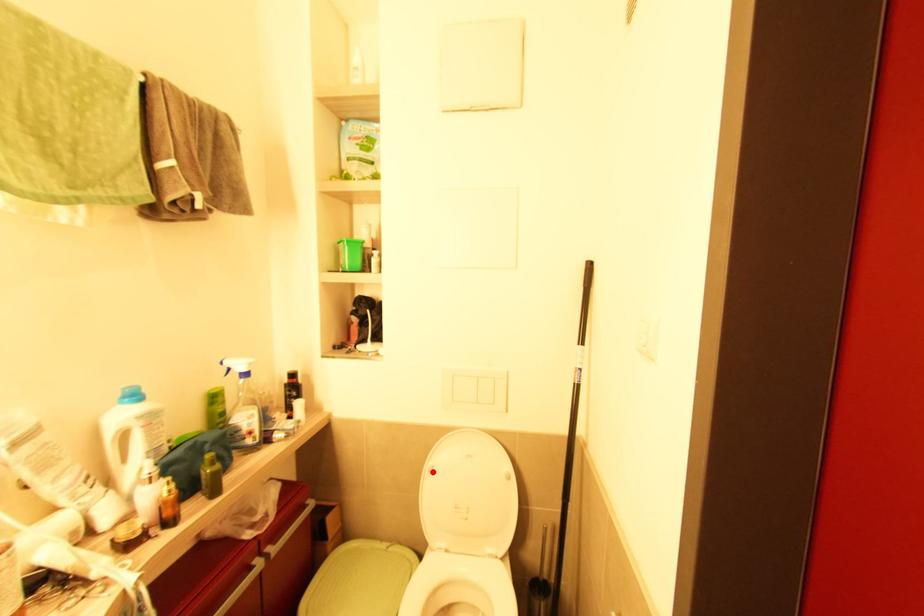
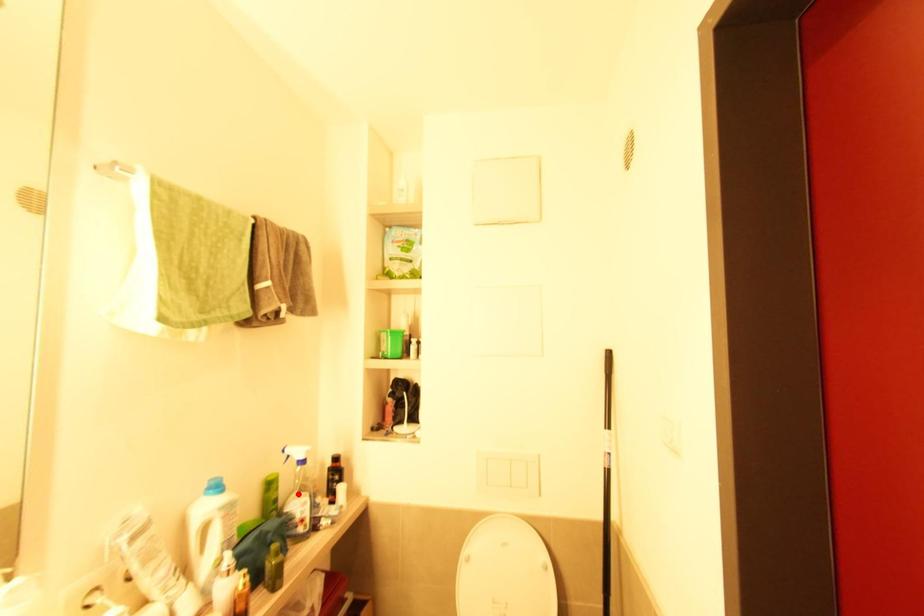
Based on the photo, I am providing you with two images of the same scene from different viewpoints. A red point is marked on the first image and another point is marked on the second image. Is the red point in image1 aligned with the point shown in image2?

No